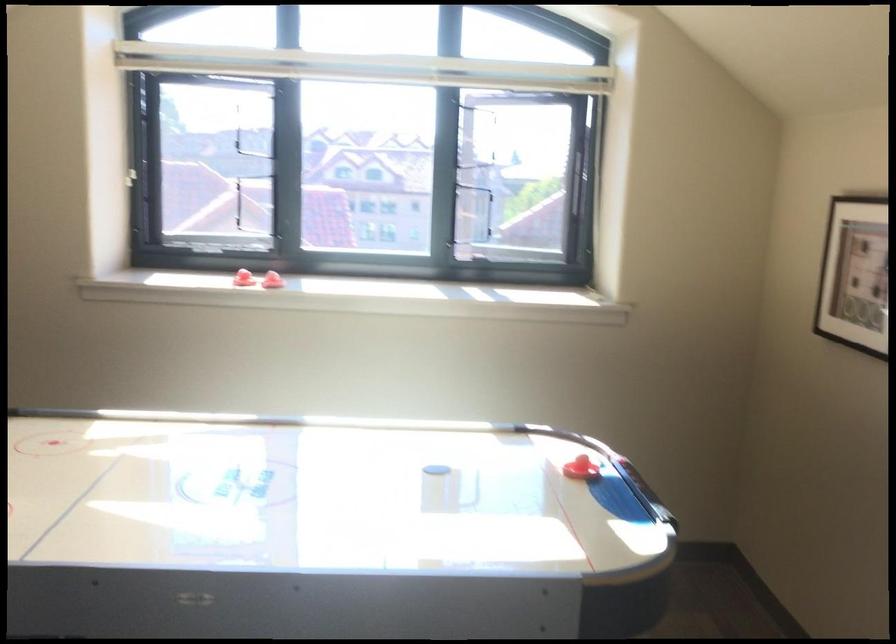
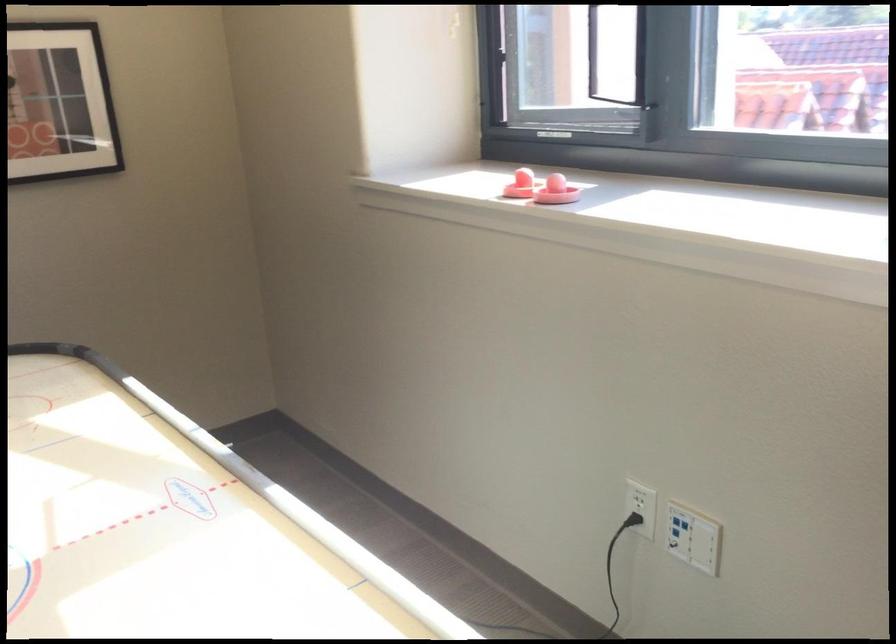
Where in the second image is the point corresponding to [263,230] from the first image?

(638, 102)